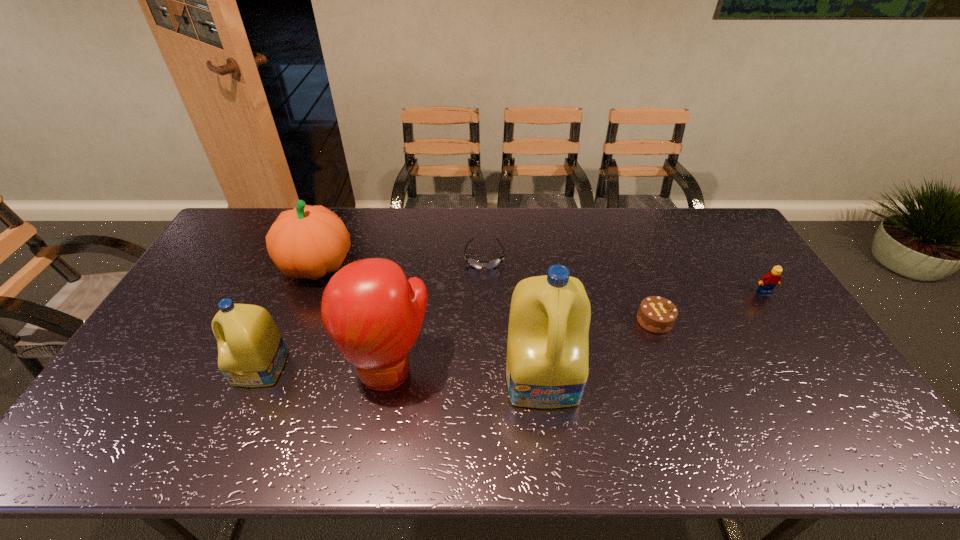
Identify the location of free space located on the label of the left detergent. (131, 369).

Identify the location of free spot located on the label of the left detergent. tap(187, 369).

Locate an element on the screen. The image size is (960, 540). vacant space located on the lenses of the sunglasses is located at coordinates (485, 325).

This screenshot has width=960, height=540. Identify the location of vacant position located on the front-facing side of the rightmost object. click(776, 308).

This screenshot has width=960, height=540. I want to click on vacant space located on the front of the pumpkin, so click(270, 382).

This screenshot has width=960, height=540. Identify the location of vacant region located on the front of the second object from right to left. (690, 413).

The height and width of the screenshot is (540, 960). Identify the location of sunglasses present at the far edge. (493, 264).

Locate an element on the screen. The height and width of the screenshot is (540, 960). pumpkin located in the far edge section of the desktop is located at coordinates (309, 242).

Find the location of a particular element. boxing glove that is at the near edge is located at coordinates [x=373, y=314].

The height and width of the screenshot is (540, 960). I want to click on object that is at the right edge, so click(768, 282).